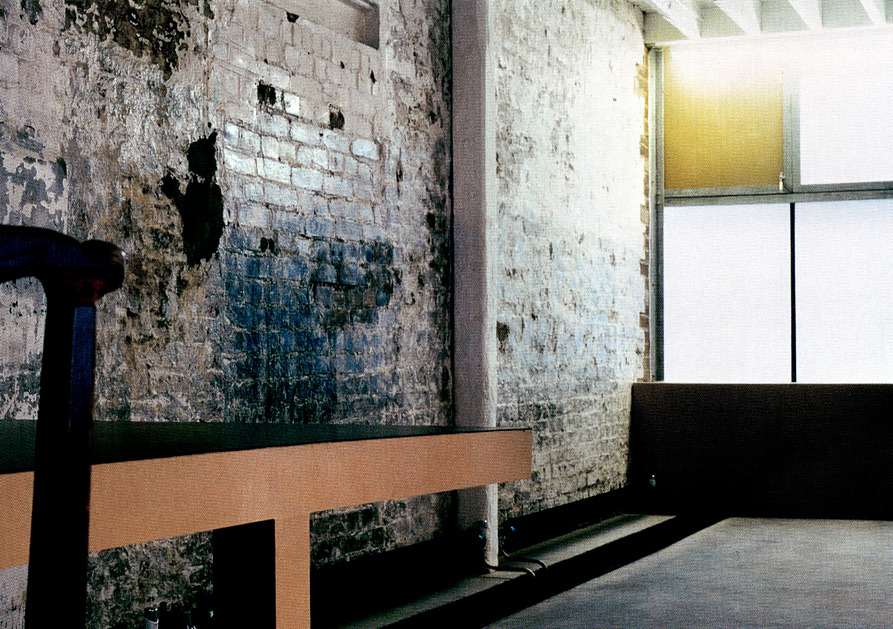
In order to click on window latch lever in this screenshot , I will do `click(780, 179)`.